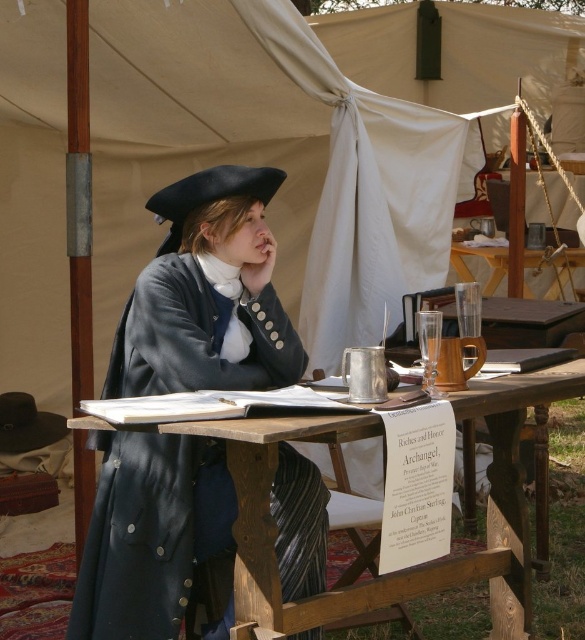
You are a guest at the historical reenactment and want to place a small book on the table. Considering the space occupied by the matte black coat at center and the wooden picnic table at center, will the book fit on the table?

The matte black coat at center is taller than the wooden picnic table at center, meaning the coat is taking up vertical space above the table. Since the book is small, it might still fit on the remaining horizontal surface of the wooden picnic table at center if there is enough space not occupied by other items like the quill pen, inkwell, glass, mug, and papers mentioned in the scene description.

You are planning to place a new decorative item on the table. Given the current items on the wooden picnic table at center and the matte black coat at center, which object has a smaller width?

The matte black coat at center has a smaller width than the wooden picnic table at center.